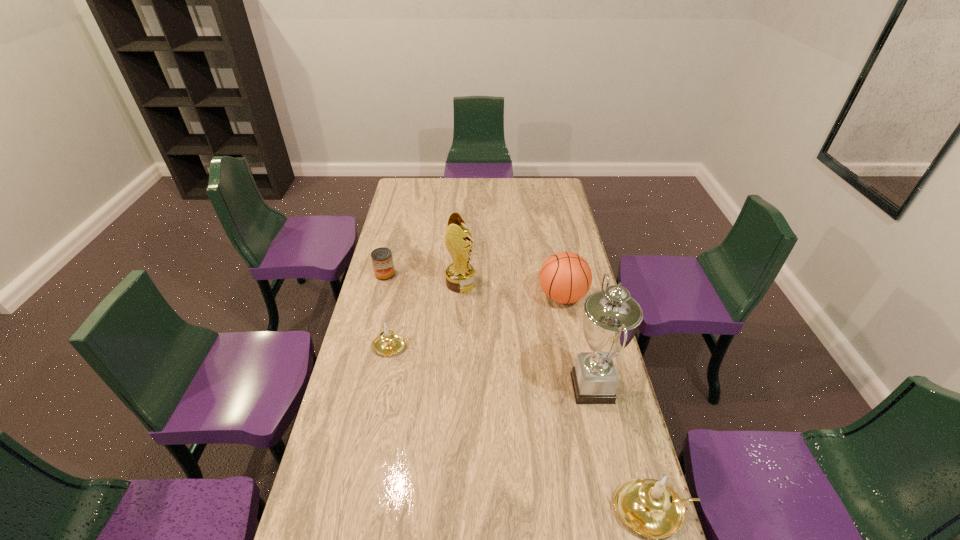
This screenshot has width=960, height=540. I want to click on object that stands as the closest to the nearest object, so click(611, 317).